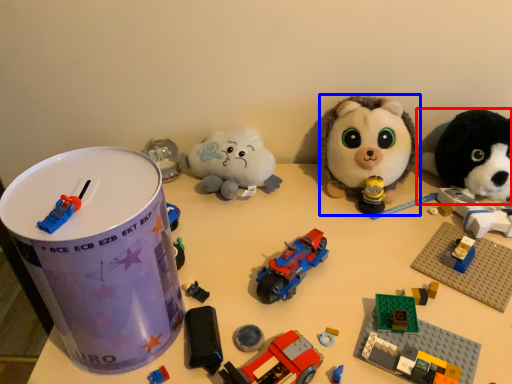
Question: Among these objects, which one is nearest to the camera, toy (highlighted by a red box) or toy (highlighted by a blue box)?

Choices:
 (A) toy
 (B) toy

Answer: (A)